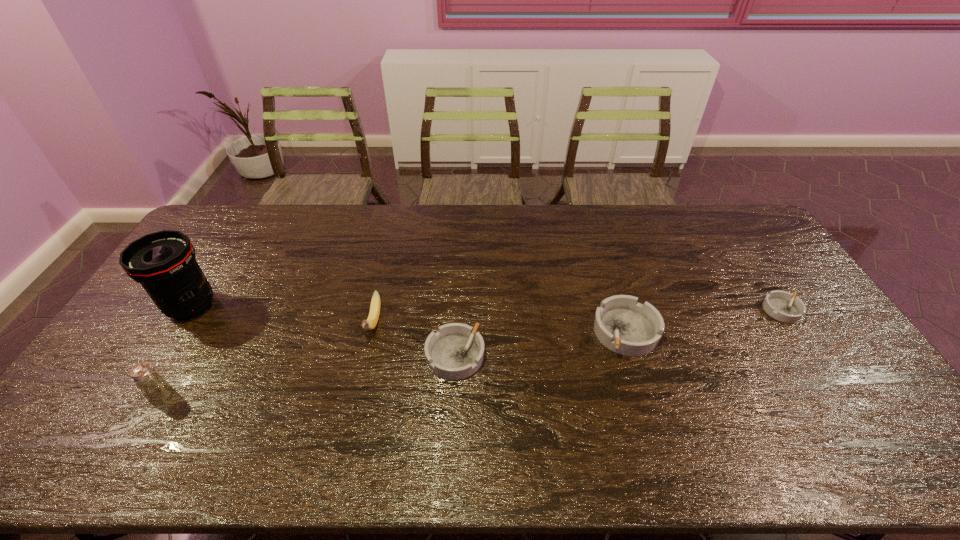
Find the location of a particular element. Image resolution: width=960 pixels, height=540 pixels. free spot located on the front of the leftmost ashtray is located at coordinates (452, 405).

You are a GUI agent. You are given a task and a screenshot of the screen. Output one action in this format:
    pyautogui.click(x=<x>, y=<y>)
    Task: Click on the vacant position located on the back of the second object from right to left
    
    Given the screenshot: What is the action you would take?
    pyautogui.click(x=608, y=271)

This screenshot has width=960, height=540. I want to click on vacant region located 0.240m on the back of the rightmost object, so point(741,248).

Where is `vacant space located on the right of the tallest object`? vacant space located on the right of the tallest object is located at coordinates (309, 306).

Identify the location of vacant space located 0.050m at the stem of the third tallest object. The height and width of the screenshot is (540, 960). (365, 360).

This screenshot has width=960, height=540. I want to click on free spot located on the left of the nearest object, so (x=108, y=395).

You are a GUI agent. You are given a task and a screenshot of the screen. Output one action in this format:
    pyautogui.click(x=<x>, y=<y>)
    Task: Click on the object that is positioned at the near edge
    This screenshot has height=540, width=960.
    Given the screenshot: What is the action you would take?
    pyautogui.click(x=155, y=389)

This screenshot has height=540, width=960. Identify the location of object positioned at the left edge. (164, 263).

Where is `object at the right edge`? The height and width of the screenshot is (540, 960). object at the right edge is located at coordinates (781, 305).

At what (x,y) coordinates should I click in order to perform the action: click on free space at the far edge of the desktop. Please return your answer as a coordinate pair (x, y). The image size is (960, 540). Looking at the image, I should click on (267, 240).